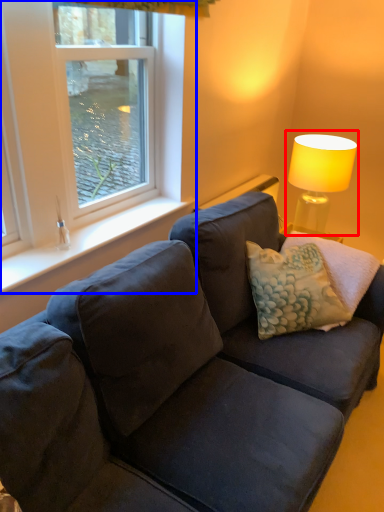
Question: Which of the following is the closest to the observer, table lamp (highlighted by a red box) or window (highlighted by a blue box)?

Choices:
 (A) table lamp
 (B) window

Answer: (B)